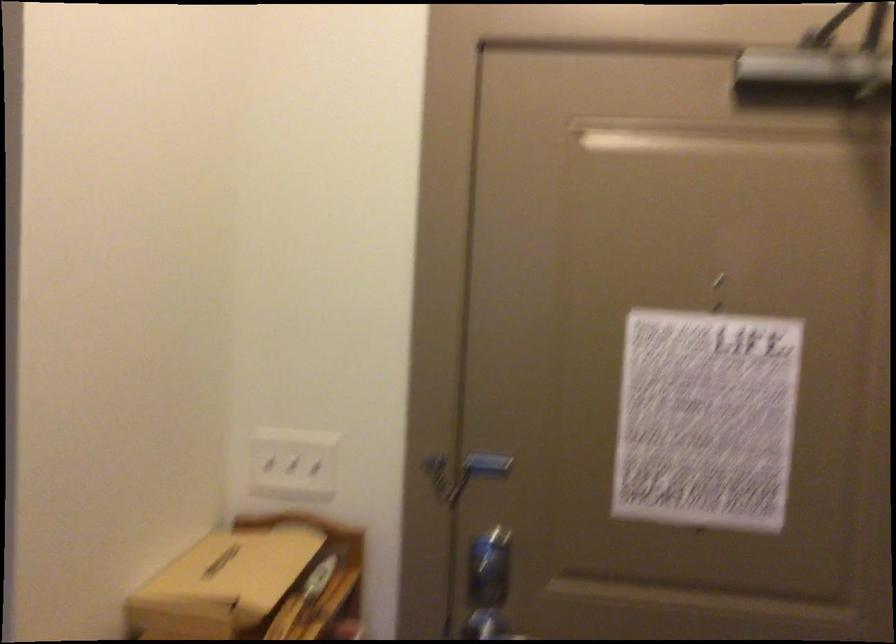
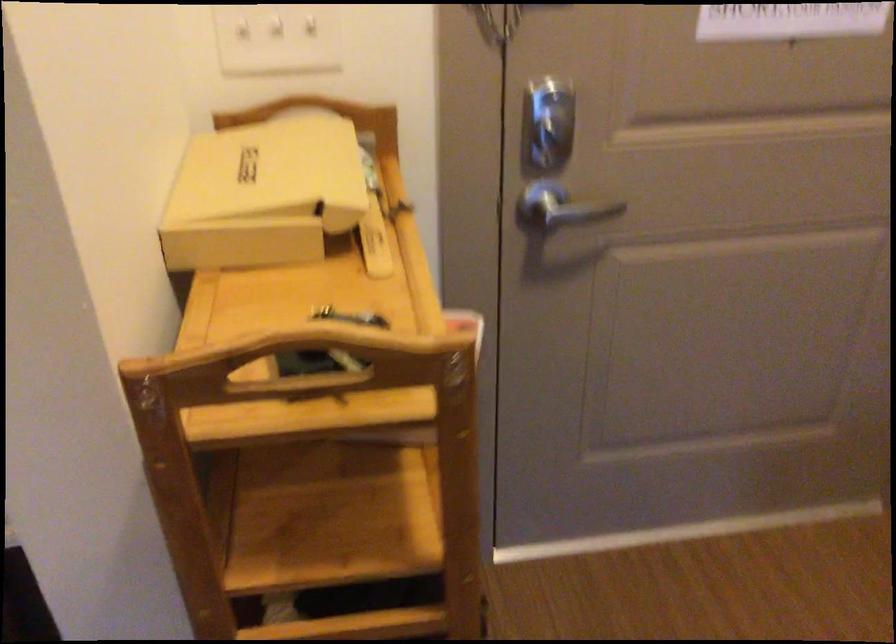
The point at (296, 471) is marked in the first image. Where is the corresponding point in the second image?

(276, 39)